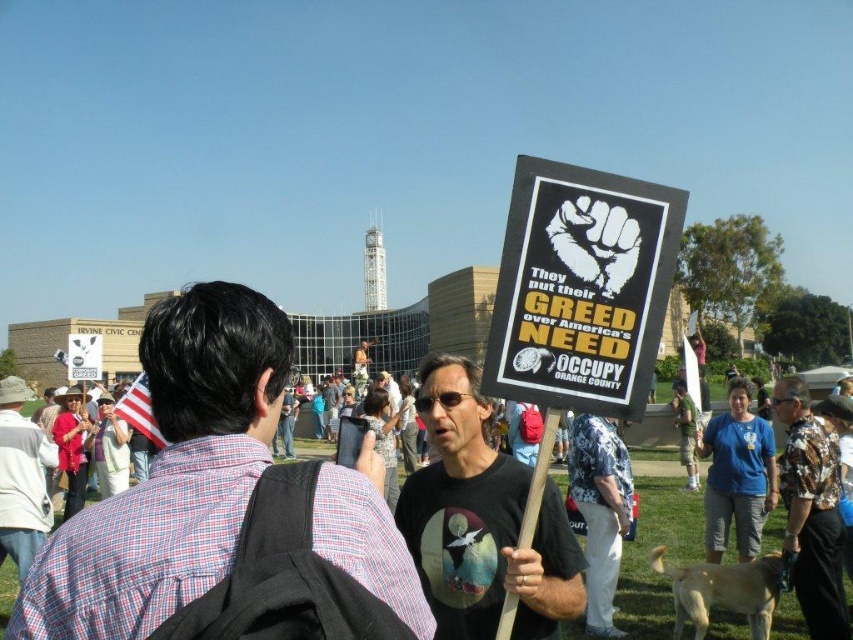
You are a photographer trying to capture both the plaid shirt at center and the hawaiian shirt at center in a single shot. Which one should you focus on to ensure both are in clear view?

You should focus on the plaid shirt at center because it is closer to the viewer than the hawaiian shirt at center, so keeping it in focus will also keep the hawaiian shirt at center in focus if the depth of field is sufficient.

You are a photographer at the protest. You want to take a photo that includes both the plaid shirt at center and the hawaiian shirt at center. Which shirt should you zoom in on to ensure both are in frame?

The plaid shirt at center is larger than the hawaiian shirt at center, so you should zoom in on the plaid shirt at center to ensure both are in frame.